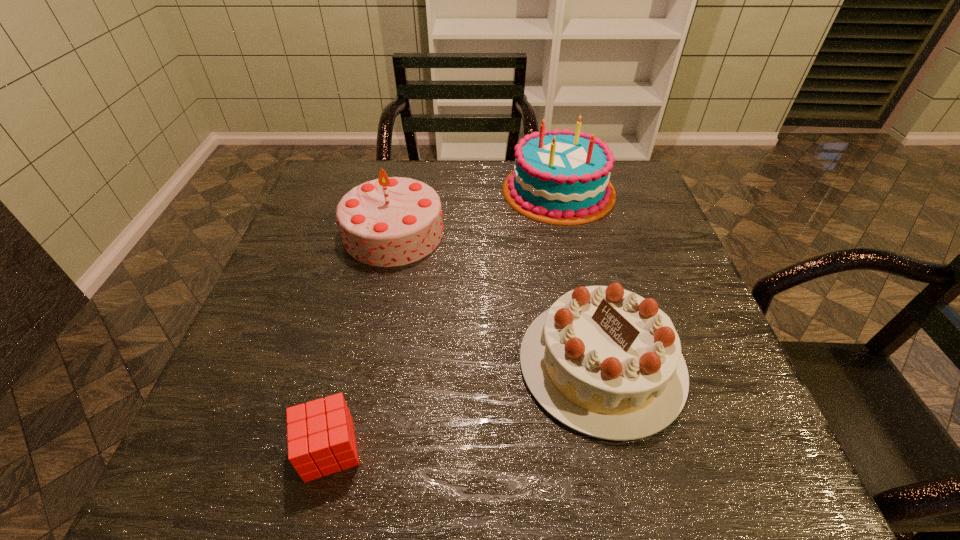
This screenshot has width=960, height=540. Find the location of `object located in the far left corner section of the desktop`. object located in the far left corner section of the desktop is located at coordinates (x=391, y=221).

Find the location of a particular element. Image resolution: width=960 pixels, height=540 pixels. object that is at the far right corner is located at coordinates (560, 177).

Where is `object that is at the near right corner`? This screenshot has width=960, height=540. object that is at the near right corner is located at coordinates (606, 362).

Locate an element on the screen. The width and height of the screenshot is (960, 540). vacant space at the far edge of the desktop is located at coordinates (442, 177).

In the image, there is a desktop. Where is `vacant space at the left edge`? vacant space at the left edge is located at coordinates (308, 275).

In order to click on blank area at the right edge in this screenshot , I will do `click(623, 225)`.

Identify the location of vacant space at the far left corner of the desktop. (372, 163).

In the image, there is a desktop. Where is `vacant space at the near left corner`? vacant space at the near left corner is located at coordinates (214, 487).

At what (x,y) coordinates should I click in order to perform the action: click on vacant space at the far right corner of the desktop. Please return your answer as a coordinate pair (x, y). This screenshot has height=540, width=960. Looking at the image, I should click on (631, 198).

You are a GUI agent. You are given a task and a screenshot of the screen. Output one action in this format:
    pyautogui.click(x=<x>, y=<y>)
    Task: Click on the blank region between the shortest object and the nearest birthday cake
    The height and width of the screenshot is (540, 960).
    Given the screenshot: What is the action you would take?
    pyautogui.click(x=466, y=407)